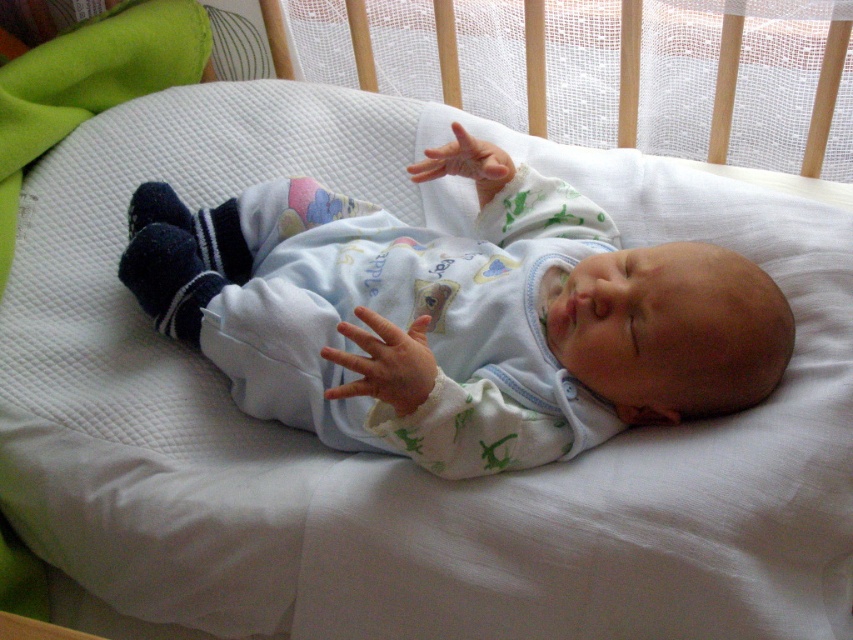
Can you confirm if white soft baby at center is taller than white soft hand at center?

Yes.

Is white soft baby at center below white soft hand at center?

Indeed, white soft baby at center is positioned under white soft hand at center.

Identify the location of white soft baby at center. Image resolution: width=853 pixels, height=640 pixels. (454, 321).

Consider the image. Does white soft fabric hand at center appear under white soft hand at center?

Yes, white soft fabric hand at center is below white soft hand at center.

Is white soft fabric hand at center taller than white soft hand at center?

Yes, white soft fabric hand at center is taller than white soft hand at center.

Identify the location of white soft fabric hand at center. (386, 362).

Consider the image. Can you confirm if white soft baby at center is positioned above white soft fabric hand at center?

Yes, white soft baby at center is above white soft fabric hand at center.

Can you confirm if white soft baby at center is positioned to the right of white soft fabric hand at center?

Correct, you'll find white soft baby at center to the right of white soft fabric hand at center.

Between point (247, 202) and point (381, 323), which one is positioned behind?

The point (247, 202) is more distant.

Where is `white soft baby at center`? The image size is (853, 640). white soft baby at center is located at coordinates (454, 321).